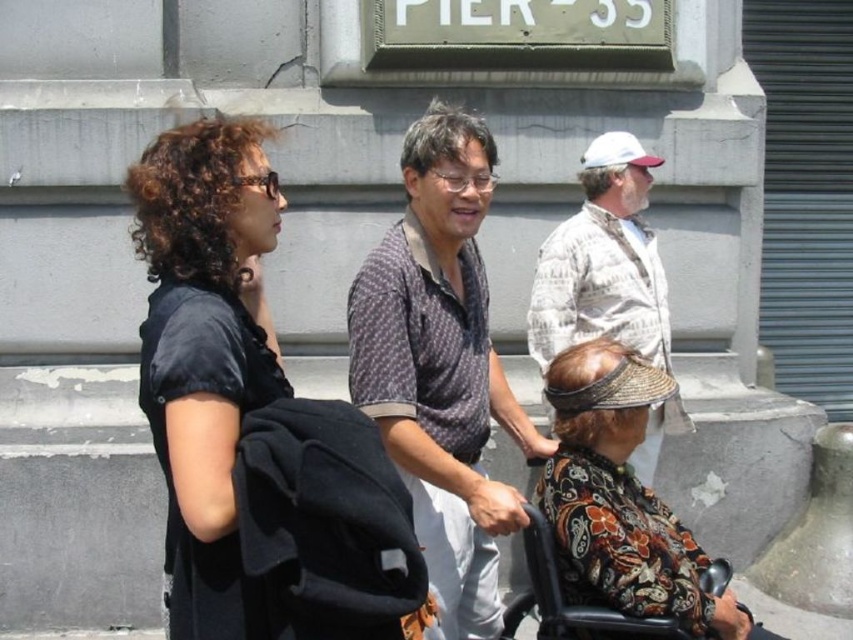
You are a photographer trying to capture a candid shot of the two people in the scene. The printed fabric headscarf at lower right and white textured shirt at upper right are important elements. Which object should you focus on first if you want to ensure both are in the frame without moving the camera?

You should focus on the printed fabric headscarf at lower right first because it is to the left of the white textured shirt at upper right, so keeping it in the frame will also include the shirt if the camera angle remains fixed.

Where is the printed fabric headscarf at lower right located in the image?

The printed fabric headscarf at lower right is located at point (619, 497) in the image.

You are a delivery person holding a package that needs to be placed on a shelf 4 meters away. The shelf is located in the same direction as the black matte backpack at center. Can you reach the shelf with the package?

The black matte backpack at center is 3.76 meters away from the camera, so the shelf 4 meters away is slightly further. You can reach the shelf with the package as it is within a reasonable distance.